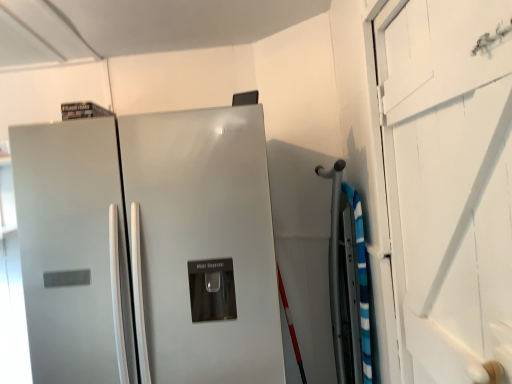
Question: Should I look upward or downward to see white wood door at right?

Choices:
 (A) up
 (B) down

Answer: (B)